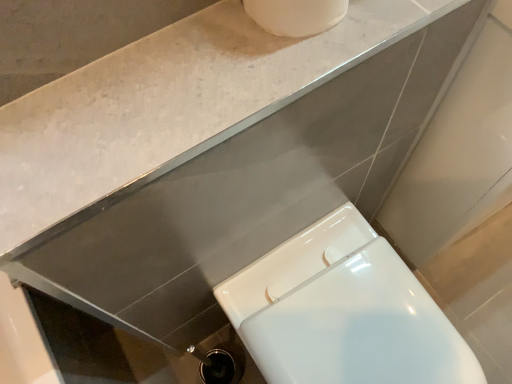
This screenshot has width=512, height=384. I want to click on white glossy toilet at lower right, so click(x=343, y=312).

This screenshot has width=512, height=384. Describe the element at coordinates (343, 312) in the screenshot. I see `white glossy toilet at lower right` at that location.

This screenshot has height=384, width=512. I want to click on white glossy countertop at upper center, so click(x=170, y=102).

What do you see at coordinates (170, 102) in the screenshot?
I see `white glossy countertop at upper center` at bounding box center [170, 102].

Identify the location of white glossy toilet at lower right. Image resolution: width=512 pixels, height=384 pixels. (343, 312).

Based on their positions, is white glossy countertop at upper center located to the left or right of white glossy toilet at lower right?

In the image, white glossy countertop at upper center appears on the left side of white glossy toilet at lower right.

Is the depth of white glossy countertop at upper center greater than that of white glossy toilet at lower right?

That is False.

Is point (172, 95) behind point (352, 235)?

No.

From the image's perspective, would you say white glossy countertop at upper center is shown under white glossy toilet at lower right?

Actually, white glossy countertop at upper center appears above white glossy toilet at lower right in the image.

From a real-world perspective, is white glossy countertop at upper center on top of white glossy toilet at lower right?

Yes, from a real-world perspective, white glossy countertop at upper center is on top of white glossy toilet at lower right.

Between white glossy countertop at upper center and white glossy toilet at lower right, which one has smaller width?

With smaller width is white glossy countertop at upper center.

Can you confirm if white glossy countertop at upper center is taller than white glossy toilet at lower right?

No, white glossy countertop at upper center is not taller than white glossy toilet at lower right.

Can you confirm if white glossy countertop at upper center is bigger than white glossy toilet at lower right?

Actually, white glossy countertop at upper center might be smaller than white glossy toilet at lower right.

Would you say white glossy toilet at lower right is part of white glossy countertop at upper center's contents?

No.

Can you see white glossy countertop at upper center touching white glossy toilet at lower right?

No, white glossy countertop at upper center is not with white glossy toilet at lower right.

Is white glossy countertop at upper center looking in the opposite direction of white glossy toilet at lower right?

white glossy countertop at upper center does not have its back to white glossy toilet at lower right.

How much distance is there between white glossy countertop at upper center and white glossy toilet at lower right?

white glossy countertop at upper center is 48.79 centimeters away from white glossy toilet at lower right.

Find the location of `counter top in front of the white glossy toilet at lower right`. counter top in front of the white glossy toilet at lower right is located at coordinates (170, 102).

Which is more to the left, white glossy toilet at lower right or white glossy countertop at upper center?

Positioned to the left is white glossy countertop at upper center.

Is white glossy toilet at lower right positioned behind white glossy countertop at upper center?

Yes, white glossy toilet at lower right is behind white glossy countertop at upper center.

Does point (353, 343) appear closer or farther from the camera than point (34, 167)?

Point (353, 343) appears to be farther away from the viewer than point (34, 167).

From the image's perspective, relative to white glossy countertop at upper center, is white glossy toilet at lower right above or below?

From the image's perspective, white glossy toilet at lower right appears below white glossy countertop at upper center.

From a real-world perspective, is white glossy toilet at lower right above or below white glossy countertop at upper center?

white glossy toilet at lower right is below white glossy countertop at upper center.

Looking at their sizes, would you say white glossy toilet at lower right is wider or thinner than white glossy countertop at upper center?

Clearly, white glossy toilet at lower right has more width compared to white glossy countertop at upper center.

In the scene shown: Can you confirm if white glossy toilet at lower right is taller than white glossy countertop at upper center?

Yes.

Is white glossy toilet at lower right bigger than white glossy countertop at upper center?

Indeed, white glossy toilet at lower right has a larger size compared to white glossy countertop at upper center.

Looking at this image, is white glossy toilet at lower right positioned beyond the bounds of white glossy countertop at upper center?

white glossy toilet at lower right is positioned outside white glossy countertop at upper center.

Is white glossy toilet at lower right next to white glossy countertop at upper center and touching it?

No, white glossy toilet at lower right is not in contact with white glossy countertop at upper center.

Is white glossy toilet at lower right aimed at white glossy countertop at upper center?

No, white glossy toilet at lower right is not facing towards white glossy countertop at upper center.

How different are the orientations of white glossy toilet at lower right and white glossy countertop at upper center in degrees?

0.525 degrees.

You are a GUI agent. You are given a task and a screenshot of the screen. Output one action in this format:
    pyautogui.click(x=<x>, y=<y>)
    Task: Click on the counter top in front of the white glossy toilet at lower right
    This screenshot has height=384, width=512.
    Given the screenshot: What is the action you would take?
    pyautogui.click(x=170, y=102)

Locate an element on the screen. The width and height of the screenshot is (512, 384). toilet lying on the right of white glossy countertop at upper center is located at coordinates (343, 312).

Where is `counter top above the white glossy toilet at lower right (from the image's perspective)`? This screenshot has width=512, height=384. counter top above the white glossy toilet at lower right (from the image's perspective) is located at coordinates (170, 102).